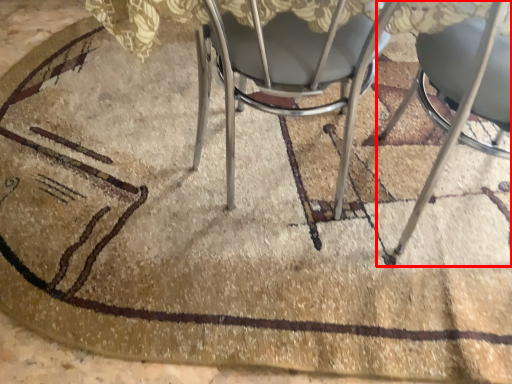
Question: Observing the image, what is the correct spatial positioning of chair (annotated by the red box) in reference to chair?

Choices:
 (A) right
 (B) left

Answer: (A)